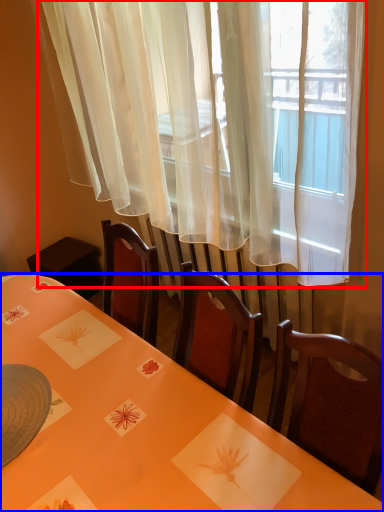
Question: Which object appears farthest to the camera in this image, curtain (highlighted by a red box) or table (highlighted by a blue box)?

Choices:
 (A) curtain
 (B) table

Answer: (A)